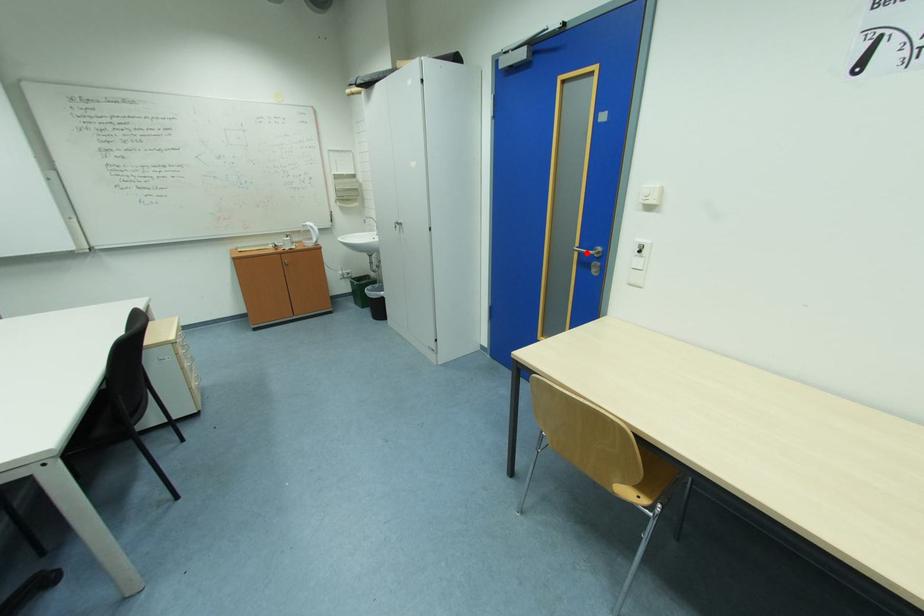
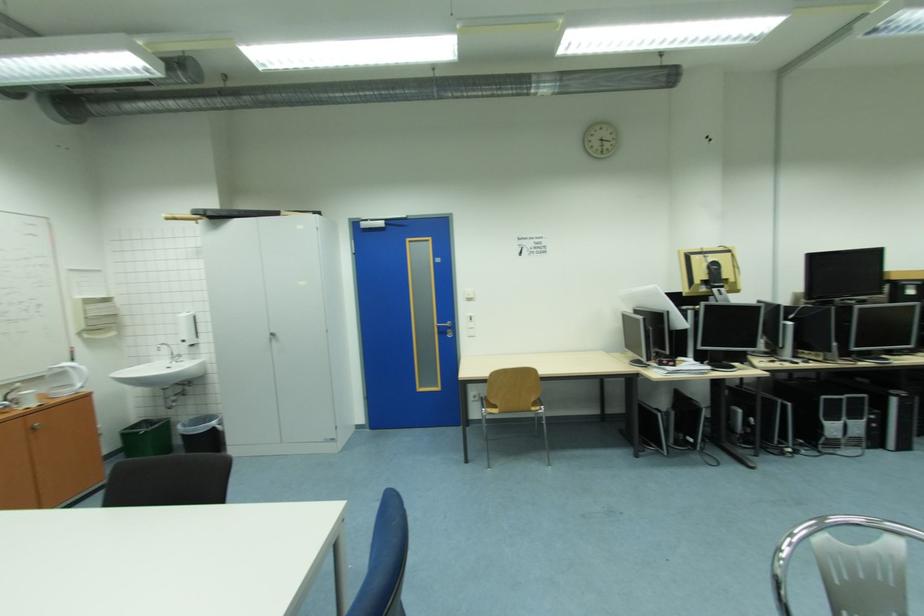
Find the pixel in the second image that matches the highlighted location in the first image.

(445, 328)